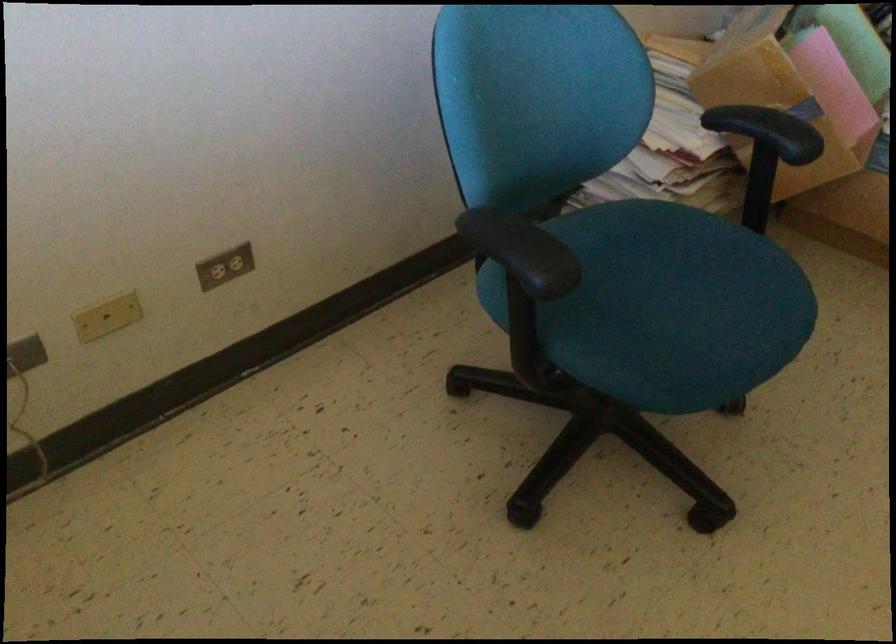
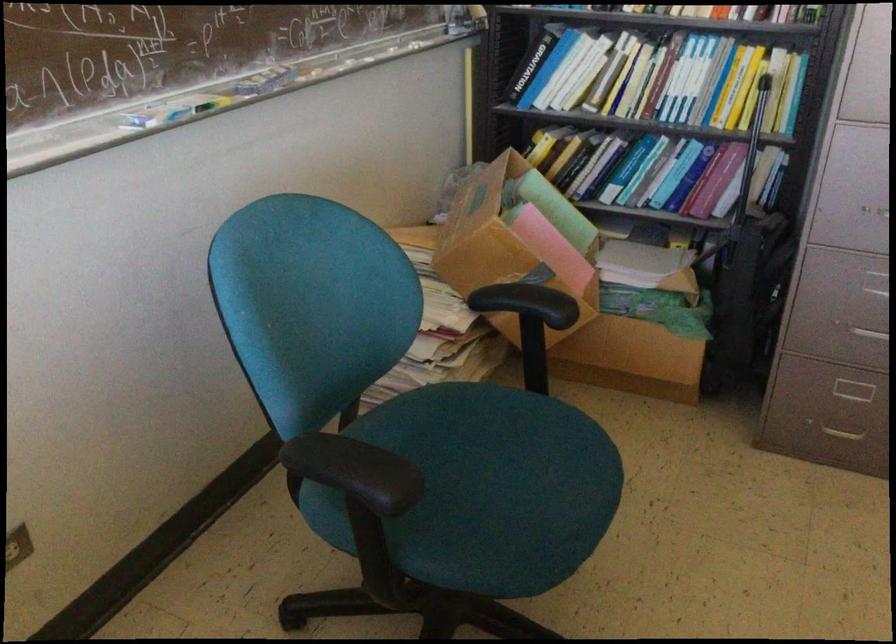
Locate, in the second image, the point that corresponds to [759,126] in the first image.

(527, 303)